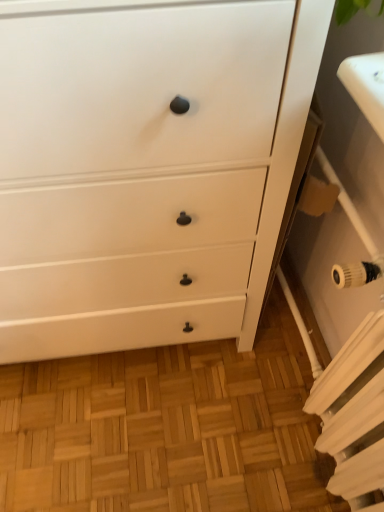
Question: Considering their positions, is white matte chest of drawers at center located in front of or behind white metallic radiator at lower right?

Choices:
 (A) front
 (B) behind

Answer: (A)

Question: From a real-world perspective, relative to white metallic radiator at lower right, is white matte chest of drawers at center vertically above or below?

Choices:
 (A) above
 (B) below

Answer: (B)

Question: Is white matte chest of drawers at center spatially inside white metallic radiator at lower right, or outside of it?

Choices:
 (A) inside
 (B) outside

Answer: (B)

Question: Looking at their shapes, would you say white metallic radiator at lower right is wider or thinner than white matte chest of drawers at center?

Choices:
 (A) thin
 (B) wide

Answer: (A)

Question: Considering the positions of white metallic radiator at lower right and white matte chest of drawers at center in the image, is white metallic radiator at lower right bigger or smaller than white matte chest of drawers at center?

Choices:
 (A) small
 (B) big

Answer: (A)

Question: Considering their positions, is white metallic radiator at lower right located in front of or behind white matte chest of drawers at center?

Choices:
 (A) front
 (B) behind

Answer: (B)

Question: Would you say white metallic radiator at lower right is inside or outside white matte chest of drawers at center?

Choices:
 (A) outside
 (B) inside

Answer: (A)